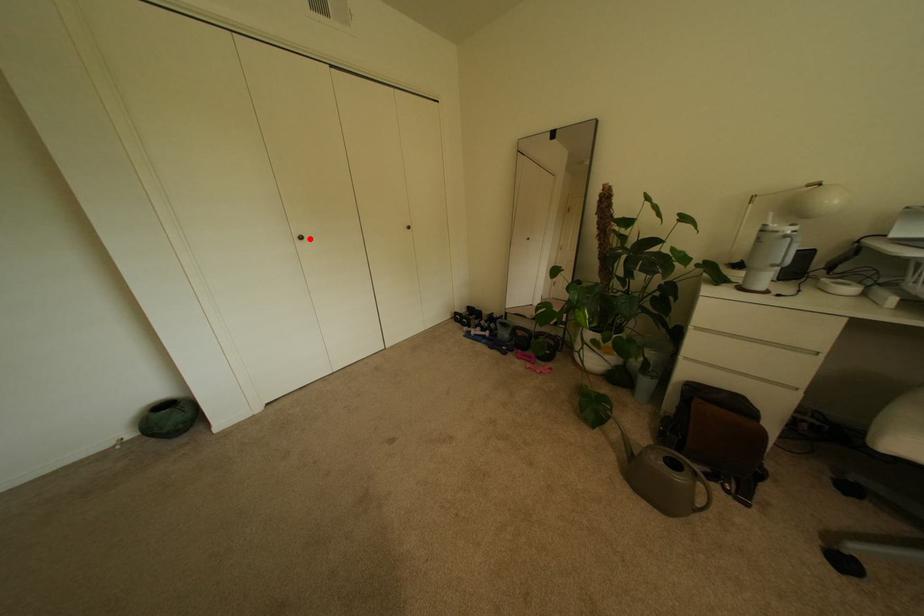
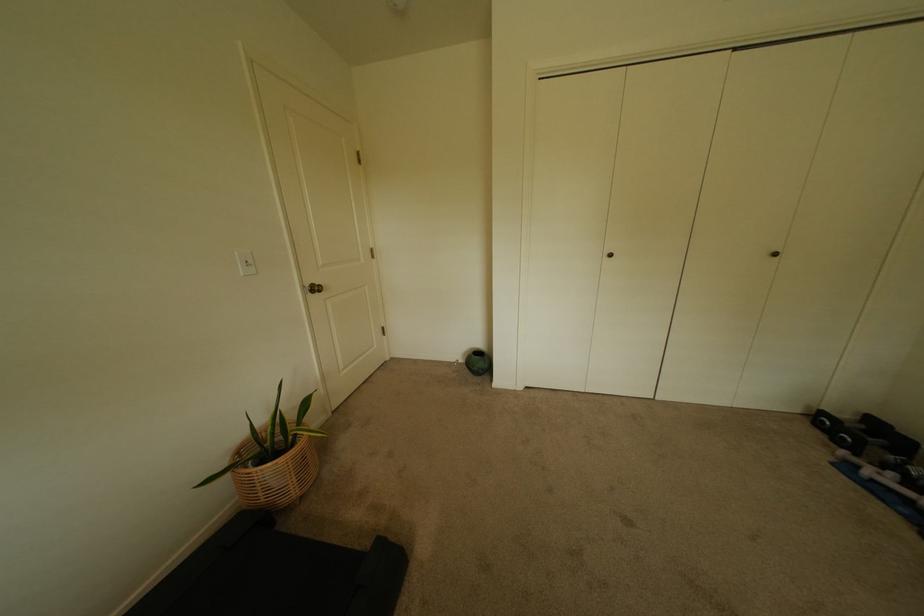
In the second image, find the point that corresponds to the highlighted location in the first image.

(618, 256)